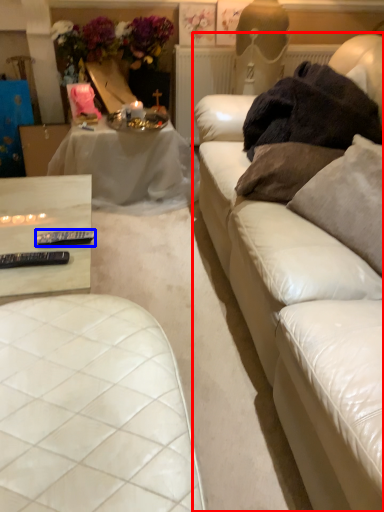
Question: Which object is further to the camera taking this photo, studio couch (highlighted by a red box) or tableware (highlighted by a blue box)?

Choices:
 (A) studio couch
 (B) tableware

Answer: (B)